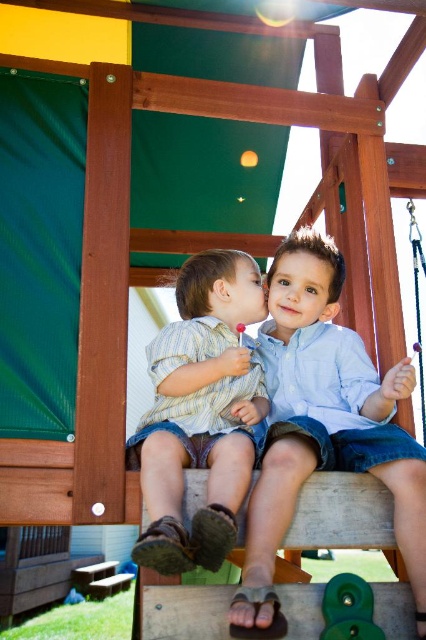
Question: Which point appears closest to the camera in this image?

Choices:
 (A) (325, 611)
 (B) (187, 461)
 (C) (236, 620)

Answer: (C)

Question: Does light blue denim shorts at center appear under striped cotton shirt at center?

Choices:
 (A) no
 (B) yes

Answer: (B)

Question: Which point is closer to the camera?

Choices:
 (A) green rubber toy at lower center
 (B) striped cotton shirt at center

Answer: (B)

Question: Observing the image, what is the correct spatial positioning of light blue denim shorts at center in reference to green rubber toy at lower center?

Choices:
 (A) left
 (B) right

Answer: (A)

Question: Considering the relative positions of light blue denim shorts at center and striped cotton shirt at center in the image provided, where is light blue denim shorts at center located with respect to striped cotton shirt at center?

Choices:
 (A) left
 (B) right

Answer: (B)

Question: Which object is farther from the camera taking this photo?

Choices:
 (A) striped cotton shirt at center
 (B) green rubber toy at lower center
 (C) light blue denim shorts at center

Answer: (B)